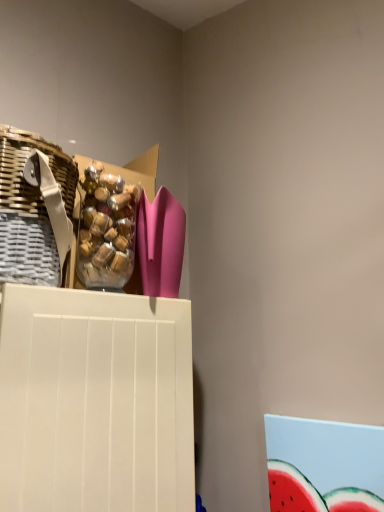
The image size is (384, 512). Describe the element at coordinates (106, 229) in the screenshot. I see `translucent plastic bag of candies at upper left` at that location.

Find the location of a particular element. translucent plastic bag of candies at upper left is located at coordinates (106, 229).

This screenshot has width=384, height=512. I want to click on woven brown basket at left, so coord(30,210).

This screenshot has width=384, height=512. What do you see at coordinates (30, 210) in the screenshot? I see `woven brown basket at left` at bounding box center [30, 210].

Locate an element on the screen. This screenshot has height=512, width=384. translucent plastic bag of candies at upper left is located at coordinates coord(106,229).

Between translucent plastic bag of candies at upper left and woven brown basket at left, which one appears on the left side from the viewer's perspective?

From the viewer's perspective, woven brown basket at left appears more on the left side.

Is translucent plastic bag of candies at upper left in front of or behind woven brown basket at left in the image?

Clearly, translucent plastic bag of candies at upper left is behind woven brown basket at left.

Considering the points (99, 184) and (18, 255), which point is behind, point (99, 184) or point (18, 255)?

The point (99, 184) is behind.

From the image's perspective, is translucent plastic bag of candies at upper left on woven brown basket at left?

No, from the image's perspective, translucent plastic bag of candies at upper left is not above woven brown basket at left.

From a real-world perspective, is translucent plastic bag of candies at upper left physically above woven brown basket at left?

No, from a real-world perspective, translucent plastic bag of candies at upper left is not over woven brown basket at left

Considering the relative sizes of translucent plastic bag of candies at upper left and woven brown basket at left in the image provided, is translucent plastic bag of candies at upper left wider than woven brown basket at left?

No.

In terms of height, does translucent plastic bag of candies at upper left look taller or shorter compared to woven brown basket at left?

Considering their sizes, translucent plastic bag of candies at upper left has less height than woven brown basket at left.

Considering the sizes of objects translucent plastic bag of candies at upper left and woven brown basket at left in the image provided, who is smaller, translucent plastic bag of candies at upper left or woven brown basket at left?

Smaller between the two is translucent plastic bag of candies at upper left.

Would you say woven brown basket at left is part of translucent plastic bag of candies at upper left's contents?

No, woven brown basket at left is not surrounded by translucent plastic bag of candies at upper left.

Is translucent plastic bag of candies at upper left touching woven brown basket at left?

translucent plastic bag of candies at upper left and woven brown basket at left are not in contact.

Is translucent plastic bag of candies at upper left positioned with its back to woven brown basket at left?

No, translucent plastic bag of candies at upper left's orientation is not away from woven brown basket at left.

Based on the photo, what's the angular difference between translucent plastic bag of candies at upper left and woven brown basket at left's facing directions?

The angle between the facing direction of translucent plastic bag of candies at upper left and the facing direction of woven brown basket at left is 2.14 degrees.

Image resolution: width=384 pixels, height=512 pixels. Identify the location of food below the woven brown basket at left (from the image's perspective). (106, 229).

Based on their positions, is woven brown basket at left located to the left or right of translucent plastic bag of candies at upper left?

woven brown basket at left is to the left of translucent plastic bag of candies at upper left.

Which object is closer to the camera taking this photo, woven brown basket at left or translucent plastic bag of candies at upper left?

Positioned in front is woven brown basket at left.

Does point (19, 159) come in front of point (97, 224)?

Yes, it is.

From the image's perspective, is woven brown basket at left below translucent plastic bag of candies at upper left?

No, from the image's perspective, woven brown basket at left is not below translucent plastic bag of candies at upper left.

From a real-world perspective, which is physically below, woven brown basket at left or translucent plastic bag of candies at upper left?

translucent plastic bag of candies at upper left.

Between woven brown basket at left and translucent plastic bag of candies at upper left, which one has smaller width?

Thinner between the two is translucent plastic bag of candies at upper left.

Which of these two, woven brown basket at left or translucent plastic bag of candies at upper left, stands taller?

With more height is woven brown basket at left.

Between woven brown basket at left and translucent plastic bag of candies at upper left, which one has smaller size?

Smaller between the two is translucent plastic bag of candies at upper left.

Would you say woven brown basket at left is inside or outside translucent plastic bag of candies at upper left?

woven brown basket at left is located beyond the bounds of translucent plastic bag of candies at upper left.

Is woven brown basket at left not near translucent plastic bag of candies at upper left?

Actually, woven brown basket at left and translucent plastic bag of candies at upper left are a little close together.

Is woven brown basket at left looking in the opposite direction of translucent plastic bag of candies at upper left?

No, woven brown basket at left is not facing away from translucent plastic bag of candies at upper left.

How much distance is there between woven brown basket at left and translucent plastic bag of candies at upper left?

woven brown basket at left and translucent plastic bag of candies at upper left are 4.52 inches apart.

Where is `basket in front of the translucent plastic bag of candies at upper left`? The width and height of the screenshot is (384, 512). basket in front of the translucent plastic bag of candies at upper left is located at coordinates (30, 210).

Locate an element on the screen. Image resolution: width=384 pixels, height=512 pixels. basket that appears on the left of translucent plastic bag of candies at upper left is located at coordinates (30, 210).

The image size is (384, 512). In order to click on food below the woven brown basket at left (from the image's perspective) in this screenshot , I will do pos(106,229).